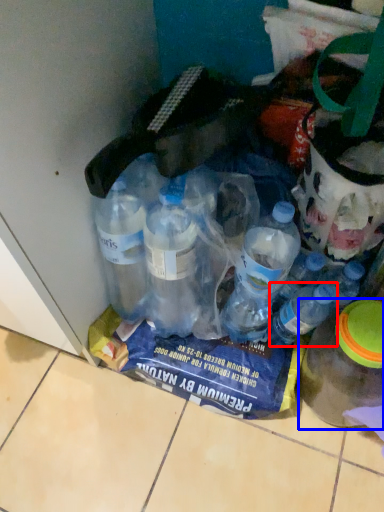
Question: Which object is further to the camera taking this photo, bottle (highlighted by a red box) or bottle (highlighted by a blue box)?

Choices:
 (A) bottle
 (B) bottle

Answer: (A)